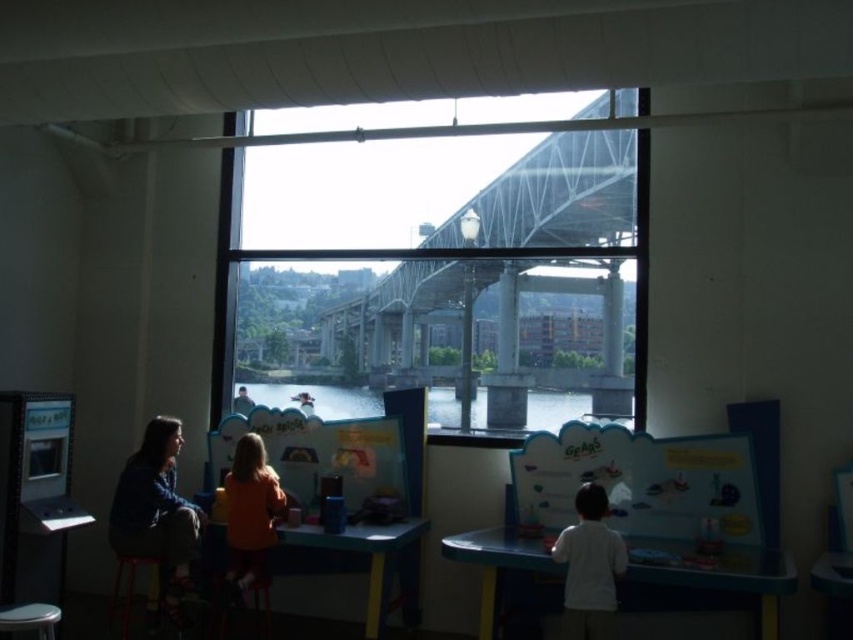
You are navigating an indoor children museum and want to cross from the left side to the right side of the room. There is a transparent glass bridge at upper center. Can you use it to cross directly from the left side to the right side?

The transparent glass bridge at upper center is located at point [447,268], which is centrally positioned between the left and right sides of the room. Therefore, you can use it to cross directly from the left side to the right side of the room.